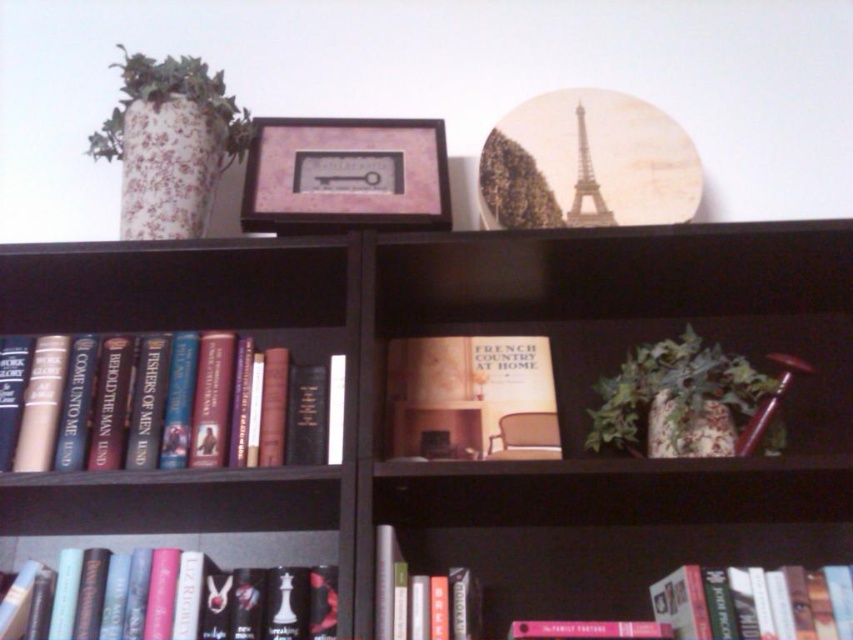
Question: Is matte wooden picture frame at upper center further to the viewer compared to green leafy plant at upper center?

Choices:
 (A) yes
 (B) no

Answer: (B)

Question: Which object is closer to the camera taking this photo?

Choices:
 (A) metallic silver eiffel tower at upper center
 (B) brown wooden bookcase at center
 (C) hardcover book at lower right
 (D) hardcover books at left

Answer: (B)

Question: Which point is closer to the camera?

Choices:
 (A) white floral vase at upper left
 (B) matte wooden picture frame at upper center

Answer: (B)

Question: Is brown wooden bookcase at center to the right of matte hardcover book at center from the viewer's perspective?

Choices:
 (A) no
 (B) yes

Answer: (A)

Question: Does hardcover books at left have a lesser width compared to matte hardcover book at center?

Choices:
 (A) yes
 (B) no

Answer: (B)

Question: Estimate the real-world distances between objects in this image. Which object is closer to the hardcover book at center?

Choices:
 (A) hardcover book at lower left
 (B) hardcover books at left
 (C) green leafy plant at upper center
 (D) metallic silver eiffel tower at upper center

Answer: (A)